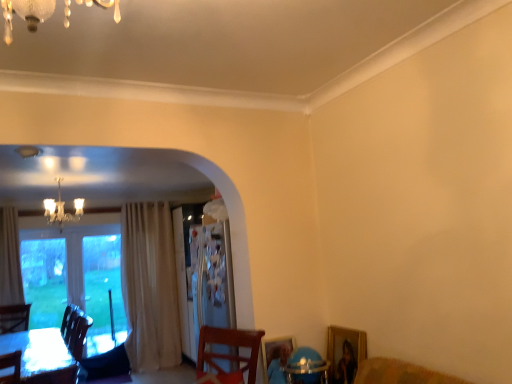
Question: Is gold-framed picture at lower right outside transparent glass window at left?

Choices:
 (A) no
 (B) yes

Answer: (B)

Question: Considering the relative positions of gold-framed picture at lower right and transparent glass window at left in the image provided, is gold-framed picture at lower right in front of transparent glass window at left?

Choices:
 (A) yes
 (B) no

Answer: (A)

Question: From a real-world perspective, does gold-framed picture at lower right stand above transparent glass window at left?

Choices:
 (A) no
 (B) yes

Answer: (A)

Question: Does gold-framed picture at lower right have a greater width compared to transparent glass window at left?

Choices:
 (A) yes
 (B) no

Answer: (B)

Question: From the image's perspective, is gold-framed picture at lower right beneath transparent glass window at left?

Choices:
 (A) yes
 (B) no

Answer: (B)

Question: Relative to white glossy table at lower left, is crystal chandelier at upper left in front or behind?

Choices:
 (A) behind
 (B) front

Answer: (A)

Question: Do you think crystal chandelier at upper left is within white glossy table at lower left, or outside of it?

Choices:
 (A) inside
 (B) outside

Answer: (B)

Question: Would you say crystal chandelier at upper left is to the left or to the right of white glossy table at lower left in the picture?

Choices:
 (A) right
 (B) left

Answer: (B)

Question: In terms of height, does crystal chandelier at upper left look taller or shorter compared to white glossy table at lower left?

Choices:
 (A) short
 (B) tall

Answer: (A)

Question: Considering the positions of gold-framed picture at lower right and crystal chandelier at upper left in the image, is gold-framed picture at lower right taller or shorter than crystal chandelier at upper left?

Choices:
 (A) short
 (B) tall

Answer: (A)

Question: In terms of width, does gold-framed picture at lower right look wider or thinner when compared to crystal chandelier at upper left?

Choices:
 (A) wide
 (B) thin

Answer: (B)

Question: From the image's perspective, is gold-framed picture at lower right located above or below crystal chandelier at upper left?

Choices:
 (A) above
 (B) below

Answer: (B)

Question: Which is correct: gold-framed picture at lower right is inside crystal chandelier at upper left, or outside of it?

Choices:
 (A) outside
 (B) inside

Answer: (A)

Question: Do you think crystal chandelier at upper left is within gold-framed picture at lower right, or outside of it?

Choices:
 (A) inside
 (B) outside

Answer: (B)

Question: From their relative heights in the image, would you say crystal chandelier at upper left is taller or shorter than gold-framed picture at lower right?

Choices:
 (A) short
 (B) tall

Answer: (B)